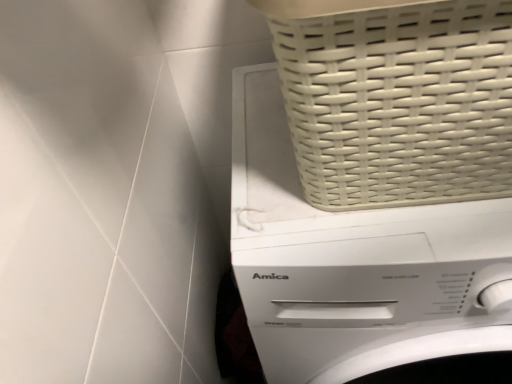
Question: Is white plastic washing machine at upper right taller or shorter than white woven basket at upper right?

Choices:
 (A) short
 (B) tall

Answer: (B)

Question: Is point (276, 279) positioned closer to the camera than point (310, 56)?

Choices:
 (A) farther
 (B) closer

Answer: (A)

Question: From the image's perspective, is white plastic washing machine at upper right positioned above or below white woven basket at upper right?

Choices:
 (A) above
 (B) below

Answer: (B)

Question: Is white woven basket at upper right inside or outside of white plastic washing machine at upper right?

Choices:
 (A) outside
 (B) inside

Answer: (A)

Question: Does point (433, 168) appear closer or farther from the camera than point (294, 213)?

Choices:
 (A) closer
 (B) farther

Answer: (A)

Question: Considering the positions of white woven basket at upper right and white plastic washing machine at upper right in the image, is white woven basket at upper right wider or thinner than white plastic washing machine at upper right?

Choices:
 (A) wide
 (B) thin

Answer: (B)

Question: Is white woven basket at upper right bigger or smaller than white plastic washing machine at upper right?

Choices:
 (A) small
 (B) big

Answer: (A)